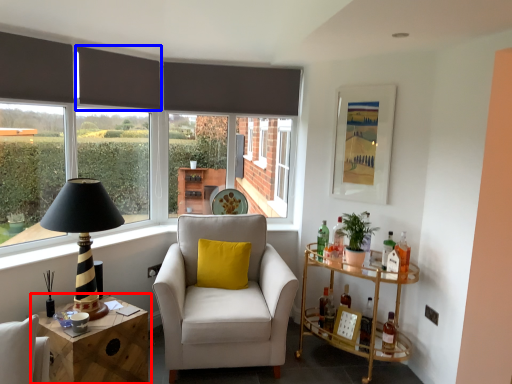
Question: Which of the following is the farthest to the observer, table (highlighted by a red box) or curtain (highlighted by a blue box)?

Choices:
 (A) table
 (B) curtain

Answer: (B)